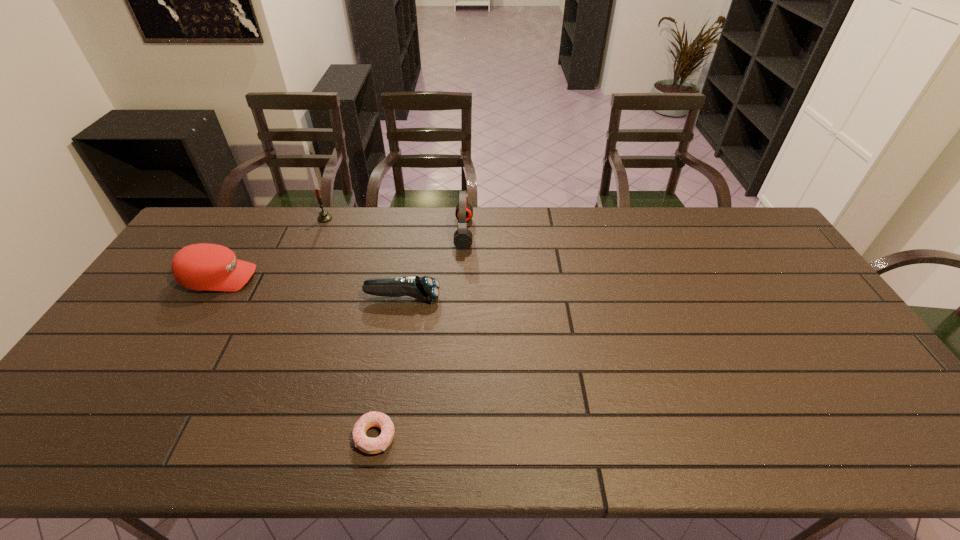
At what (x,y) coordinates should I click in order to perform the action: click on the tallest object. Please return your answer as a coordinate pair (x, y). The width and height of the screenshot is (960, 540). Looking at the image, I should click on (463, 237).

Locate an element on the screen. the rightmost object is located at coordinates [x=463, y=237].

At what (x,y) coordinates should I click in order to perform the action: click on the second tallest object. Please return your answer as a coordinate pair (x, y). The height and width of the screenshot is (540, 960). Looking at the image, I should click on (324, 216).

At what (x,y) coordinates should I click in order to perform the action: click on the second object from left to right. Please return your answer as a coordinate pair (x, y). Looking at the image, I should click on (324, 216).

You are a GUI agent. You are given a task and a screenshot of the screen. Output one action in this format:
    pyautogui.click(x=<x>, y=<y>)
    Task: Click on the cap
    This screenshot has height=540, width=960.
    Given the screenshot: What is the action you would take?
    pyautogui.click(x=203, y=267)

I want to click on the leftmost object, so click(x=203, y=267).

Locate an element on the screen. The height and width of the screenshot is (540, 960). the second shortest object is located at coordinates (425, 288).

You are a GUI agent. You are given a task and a screenshot of the screen. Output one action in this format:
    pyautogui.click(x=<x>, y=<y>)
    Task: Click on the shortest object
    The width and height of the screenshot is (960, 540).
    Given the screenshot: What is the action you would take?
    pyautogui.click(x=368, y=445)

Identify the location of doughnut. (368, 445).

Locate an element on the screen. vacant space located on the ear cups of the tallest object is located at coordinates (516, 233).